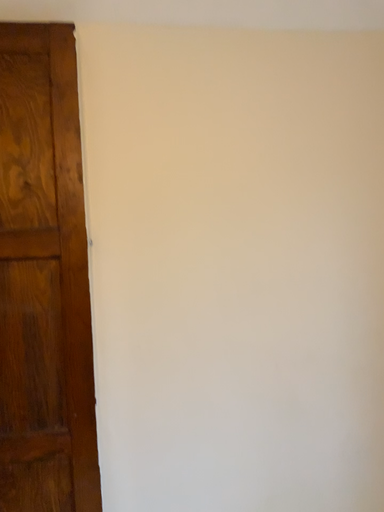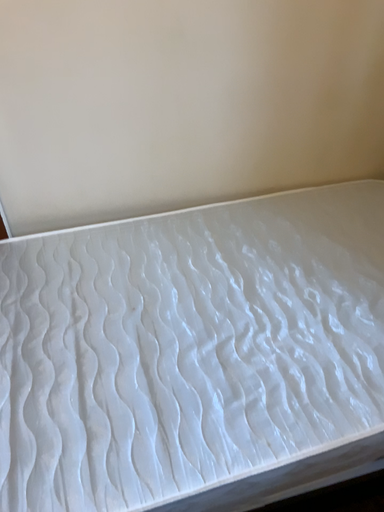
Question: Which way did the camera rotate in the video?

Choices:
 (A) rotated upward
 (B) rotated downward

Answer: (B)